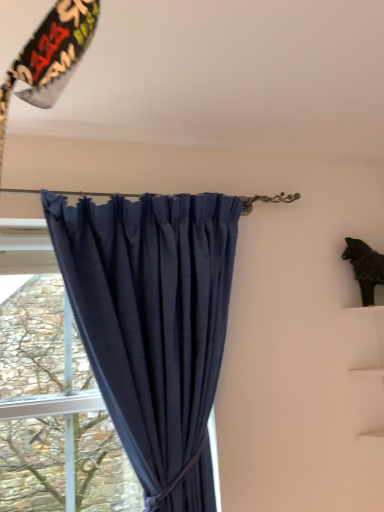
Question: Does green leafy tree at left have a lesser width compared to navy blue fabric curtain at center?

Choices:
 (A) yes
 (B) no

Answer: (A)

Question: Is green leafy tree at left at the left side of navy blue fabric curtain at center?

Choices:
 (A) no
 (B) yes

Answer: (B)

Question: Is green leafy tree at left bigger than navy blue fabric curtain at center?

Choices:
 (A) no
 (B) yes

Answer: (A)

Question: Is green leafy tree at left outside navy blue fabric curtain at center?

Choices:
 (A) no
 (B) yes

Answer: (B)

Question: Is green leafy tree at left further to the viewer compared to navy blue fabric curtain at center?

Choices:
 (A) no
 (B) yes

Answer: (B)

Question: Is green leafy tree at left to the left or to the right of navy blue fabric curtain at center in the image?

Choices:
 (A) right
 (B) left

Answer: (B)

Question: From a real-world perspective, relative to navy blue fabric curtain at center, is green leafy tree at left vertically above or below?

Choices:
 (A) above
 (B) below

Answer: (B)

Question: In the image, is green leafy tree at left positioned in front of or behind navy blue fabric curtain at center?

Choices:
 (A) behind
 (B) front

Answer: (A)

Question: Is green leafy tree at left spatially inside navy blue fabric curtain at center, or outside of it?

Choices:
 (A) inside
 (B) outside

Answer: (B)

Question: In the image, is navy blue fabric curtain at center on the left side or the right side of green leafy tree at left?

Choices:
 (A) right
 (B) left

Answer: (A)

Question: From a real-world perspective, is navy blue fabric curtain at center positioned above or below green leafy tree at left?

Choices:
 (A) above
 (B) below

Answer: (A)

Question: Considering their positions, is navy blue fabric curtain at center located in front of or behind green leafy tree at left?

Choices:
 (A) behind
 (B) front

Answer: (B)

Question: Is navy blue fabric curtain at center inside the boundaries of green leafy tree at left, or outside?

Choices:
 (A) outside
 (B) inside

Answer: (A)

Question: Is point (119, 477) positioned closer to the camera than point (365, 288)?

Choices:
 (A) closer
 (B) farther

Answer: (A)

Question: Considering the positions of green leafy tree at left and black matte cat at upper right in the image, is green leafy tree at left bigger or smaller than black matte cat at upper right?

Choices:
 (A) big
 (B) small

Answer: (A)